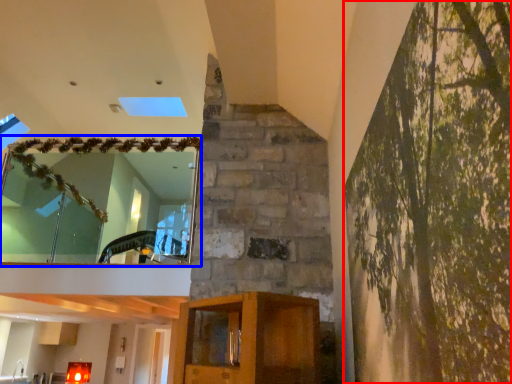
Question: Which point is further to the camera, tree (highlighted by a red box) or window (highlighted by a blue box)?

Choices:
 (A) tree
 (B) window

Answer: (B)